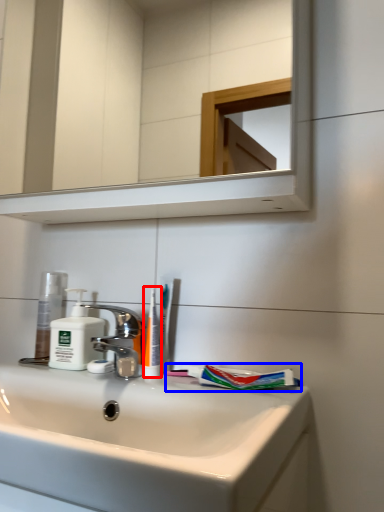
Question: Which object is closer to the camera taking this photo, toothbrush (highlighted by a red box) or toothpaste (highlighted by a blue box)?

Choices:
 (A) toothbrush
 (B) toothpaste

Answer: (B)